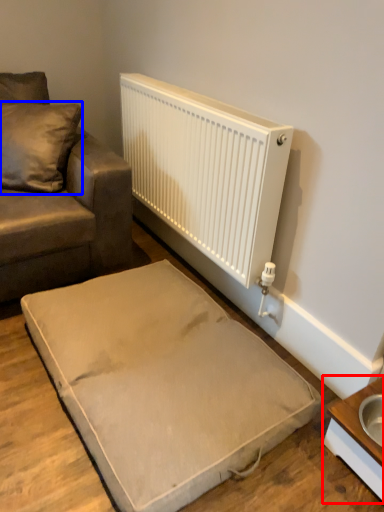
Question: Among these objects, which one is nearest to the camera, table (highlighted by a red box) or pillow (highlighted by a blue box)?

Choices:
 (A) table
 (B) pillow

Answer: (A)